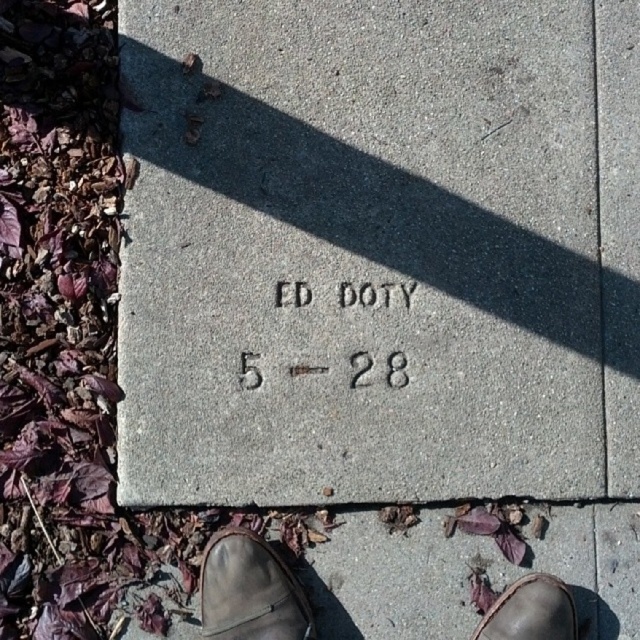
Does black engraved text at center have a lesser width compared to brown leather shoe at lower center?

Incorrect, black engraved text at center's width is not less than brown leather shoe at lower center's.

The height and width of the screenshot is (640, 640). I want to click on black engraved text at center, so click(374, 294).

Does point (424, 300) lie behind point (257, 536)?

Yes, it is.

Can you confirm if gray concrete marker at center is bigger than leather boot at lower center?

Indeed, gray concrete marker at center has a larger size compared to leather boot at lower center.

Does point (216, 353) come closer to viewer compared to point (294, 636)?

No.

Where is `gray concrete marker at center`? The width and height of the screenshot is (640, 640). gray concrete marker at center is located at coordinates pyautogui.click(x=380, y=250).

Is leather boot at lower center wider than black engraved text at center?

In fact, leather boot at lower center might be narrower than black engraved text at center.

In the scene shown: Which of these two, leather boot at lower center or black engraved text at center, stands shorter?

Standing shorter between the two is leather boot at lower center.

Locate an element on the screen. The height and width of the screenshot is (640, 640). leather boot at lower center is located at coordinates (250, 589).